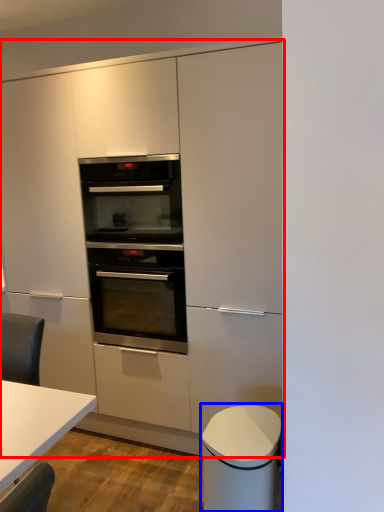
Question: Which object appears farthest to the camera in this image, cabinetry (highlighted by a red box) or cabinetry (highlighted by a blue box)?

Choices:
 (A) cabinetry
 (B) cabinetry

Answer: (A)